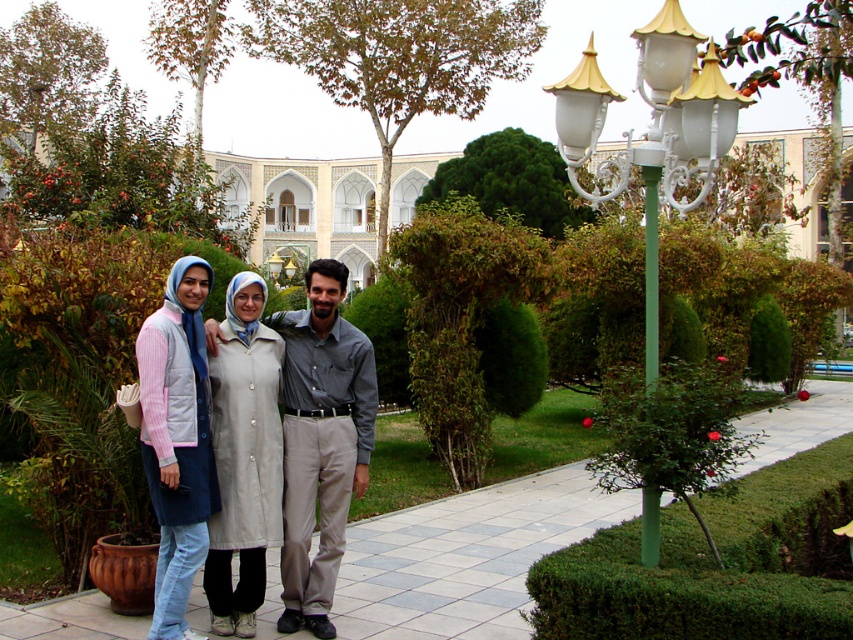
You are a photographer trying to capture a photo of the beige fabric coat at center without including the white glossy lamp post at upper right in the frame. Based on their positions, is it possible to adjust your camera angle to achieve this?

The white glossy lamp post at upper right is closer to the viewer than the beige fabric coat at center. By adjusting the camera angle downward or moving closer to the beige fabric coat at center, you can potentially exclude the lamp post from the frame since it is positioned in front.

You are a photographer standing in the garden and want to capture a photo that includes both the light gray fabric coat at center and the white glossy lamp post at upper right. Which object should be placed closer to the camera to ensure both are in focus?

The light gray fabric coat at center is shorter than the white glossy lamp post at upper right, so to ensure both are in focus, the photographer should place the light gray fabric coat at center closer to the camera.